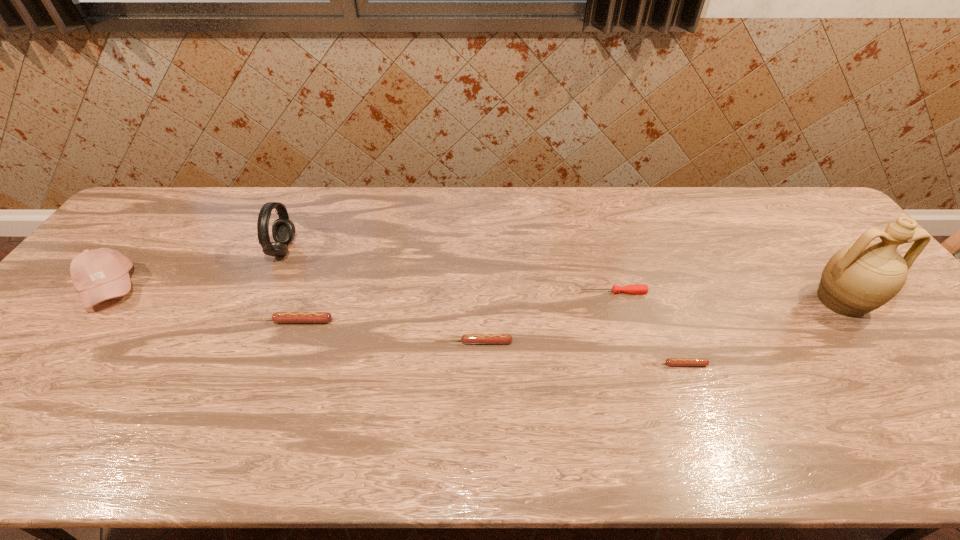
In order to click on vacant area situated 0.110m on the front-facing side of the baseball cap in this screenshot , I will do `click(181, 288)`.

Where is `object located at the left edge`? The height and width of the screenshot is (540, 960). object located at the left edge is located at coordinates (100, 274).

Where is `object that is at the right edge`? Image resolution: width=960 pixels, height=540 pixels. object that is at the right edge is located at coordinates (860, 277).

Find the location of a particular element. The image size is (960, 540). free space at the far edge of the desktop is located at coordinates (240, 226).

The image size is (960, 540). Identify the location of blank area at the near edge. (660, 401).

Locate an element on the screen. The width and height of the screenshot is (960, 540). vacant point at the far left corner is located at coordinates (188, 202).

This screenshot has width=960, height=540. In order to click on blank area at the far right corner in this screenshot , I will do `click(803, 193)`.

The height and width of the screenshot is (540, 960). I want to click on vacant area that lies between the screwdriver and the baseball cap, so click(x=362, y=290).

Identify the location of vacant region between the screwdriver and the fourth tallest object. (451, 307).

Where is `vacant space in between the rightmost sausage and the fourth object from right to left`? vacant space in between the rightmost sausage and the fourth object from right to left is located at coordinates (575, 353).